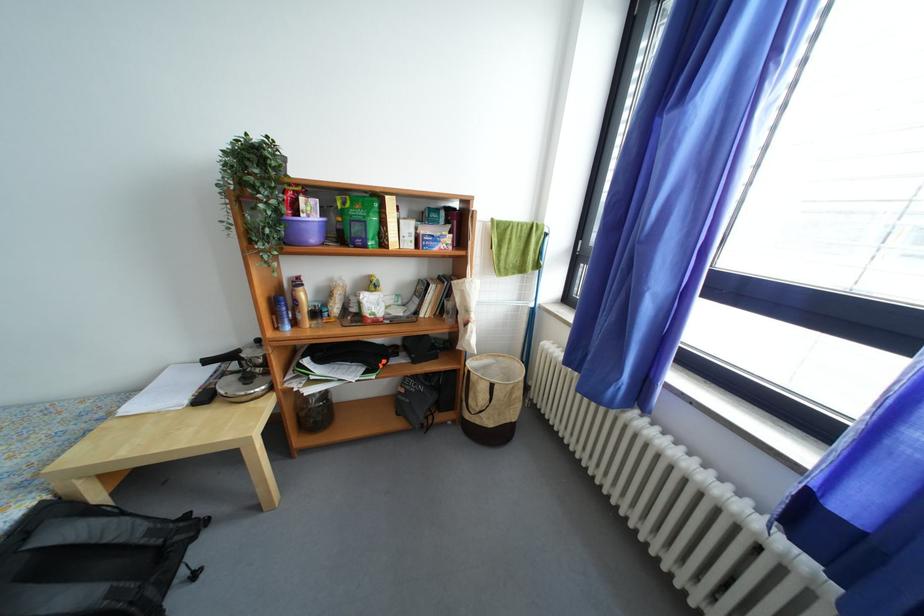
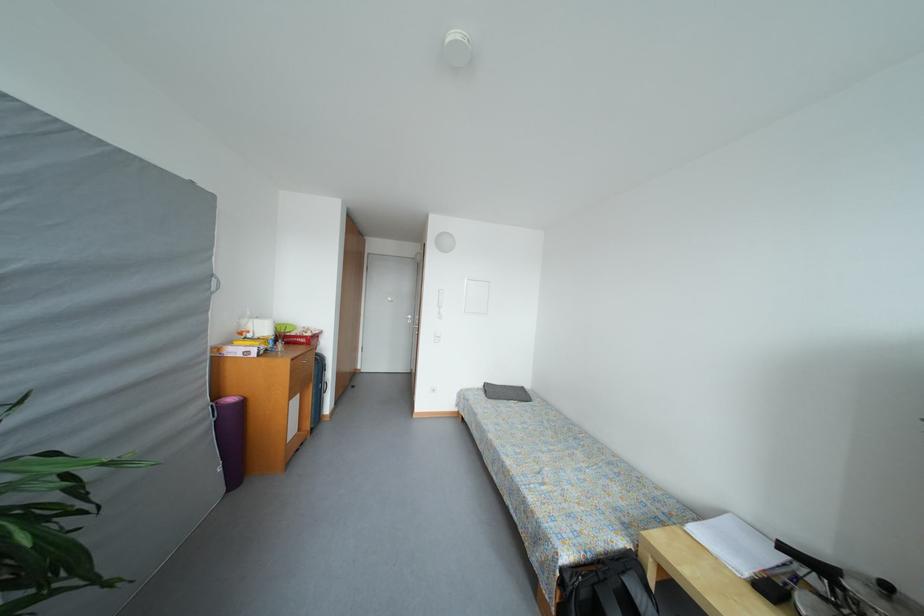
The point at (115, 429) is marked in the first image. Where is the corresponding point in the second image?

(684, 533)